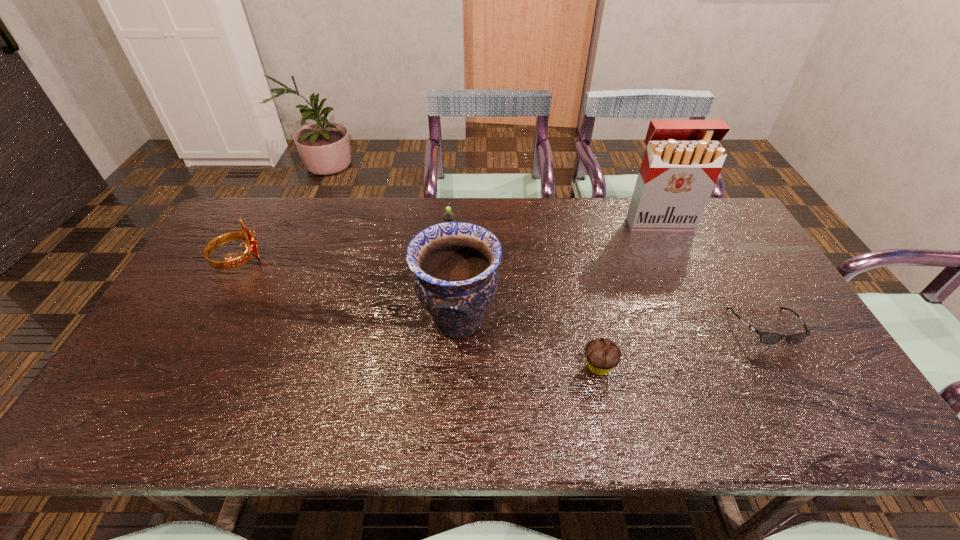
Find the location of `object located in the far right corner section of the desktop`. object located in the far right corner section of the desktop is located at coordinates (682, 161).

You are a GUI agent. You are given a task and a screenshot of the screen. Output one action in this format:
    pyautogui.click(x=<x>, y=<y>)
    Task: Click on the vacant space at the far edge
    
    Given the screenshot: What is the action you would take?
    pyautogui.click(x=477, y=219)

The height and width of the screenshot is (540, 960). Identify the location of vacant space at the near edge of the desktop. (385, 431).

In the image, there is a desktop. Where is `free space at the right edge`? The width and height of the screenshot is (960, 540). free space at the right edge is located at coordinates (783, 355).

This screenshot has height=540, width=960. In order to click on free space at the far left corner of the desktop in this screenshot , I will do `click(252, 213)`.

This screenshot has height=540, width=960. I want to click on free space at the far right corner of the desktop, so click(x=727, y=235).

Find the location of a particular element. empty location between the leftmost object and the shortest object is located at coordinates (502, 294).

The width and height of the screenshot is (960, 540). What are the coordinates of `vacant space in between the farthest object and the sunglasses` in the screenshot? It's located at (x=712, y=275).

Identify the location of vacant area between the sunglasses and the soda. (608, 285).

You are a GUI agent. You are given a task and a screenshot of the screen. Output one action in this format:
    pyautogui.click(x=<x>, y=<y>)
    Task: Click on the free spot between the shortest object and the third shortest object
    
    Given the screenshot: What is the action you would take?
    pyautogui.click(x=608, y=285)